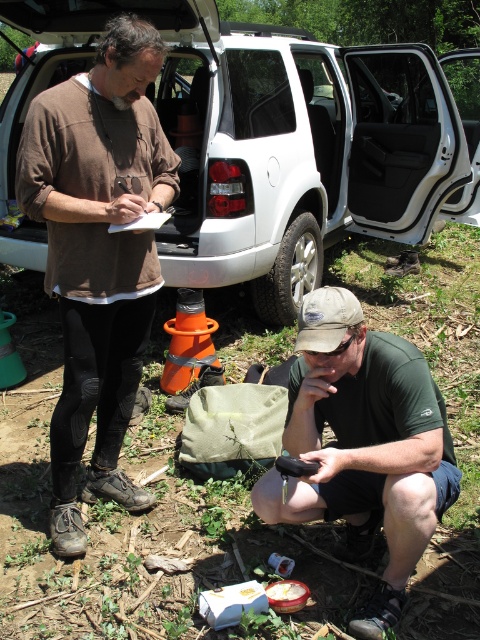
Looking at this image, you are a field researcher who needs to place a 6.5 feet long equipment between the white matte suv at center and the brown matte shirt at upper left. Is there enough space?

The white matte suv at center is 7.13 feet from the brown matte shirt at upper left. Since the equipment is 6.5 feet long, there is sufficient space to place it between them.